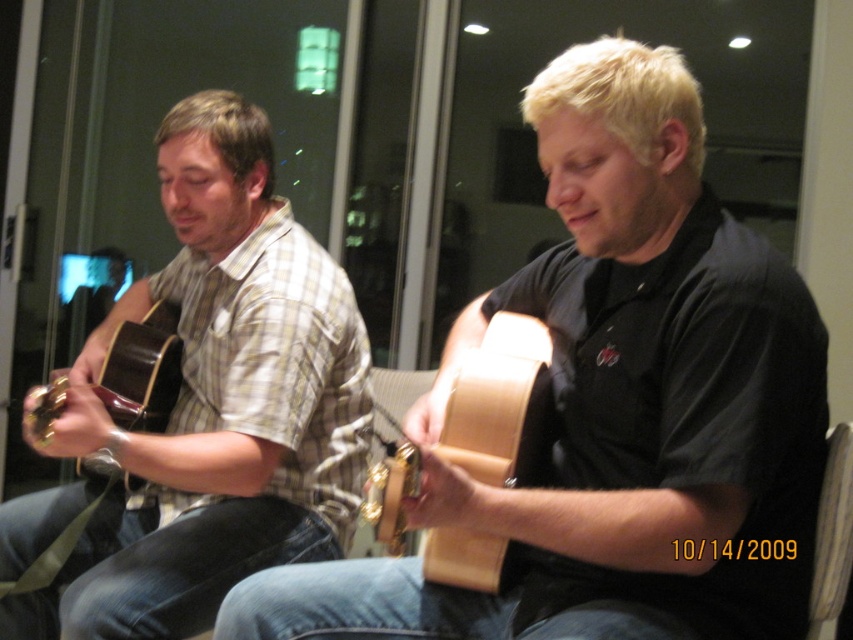
You are a music teacher observing two students playing guitars in a room with city lights visible outside. You notice the matte brown guitar at left and the matte brown acoustic guitar at left. Which guitar is bigger?

The matte brown guitar at left is larger in size compared to the matte brown acoustic guitar at left.

You are a photographer setting up for a shoot in the room. You need to position a light to the left of the natural wood acoustic guitar at center and another light to the right of the matte wood guitar at center. Will the two lights be placed on the same side of the room relative to each other?

The matte wood guitar at center is to the right of the natural wood acoustic guitar at center. Therefore, placing a light to the left of the natural wood acoustic guitar at center and another to the right of the matte wood guitar at center means the two lights will be on opposite sides of the room relative to each other.